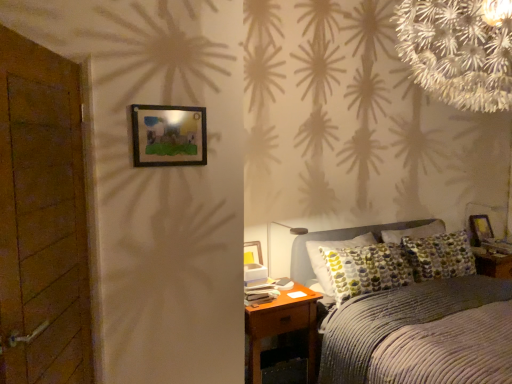
Question: Is brown wooden nightstand at lower right in front of or behind wooden picture frame at right, which is the 2th picture frame in top-to-bottom order, in the image?

Choices:
 (A) behind
 (B) front

Answer: (B)

Question: From the image's perspective, is brown wooden nightstand at lower right above or below wooden picture frame at right, the second picture frame from the front?

Choices:
 (A) above
 (B) below

Answer: (B)

Question: Which object is positioned farthest from the wooden picture frame at right, the 2th picture frame positioned from the left?

Choices:
 (A) brown wooden nightstand at lower right
 (B) wooden picture frame at upper center, positioned as the first picture frame in front-to-back order
 (C) corduroy bed at center
 (D) wooden door at left
 (E) matte gray table lamp at center

Answer: (D)

Question: Based on their relative distances, which object is farther from the wooden door at left?

Choices:
 (A) corduroy bed at center
 (B) wooden picture frame at upper center, the second picture frame positioned from the right
 (C) wooden picture frame at right, which is the first picture frame in back-to-front order
 (D) brown wooden nightstand at lower right
 (E) matte gray table lamp at center

Answer: (C)